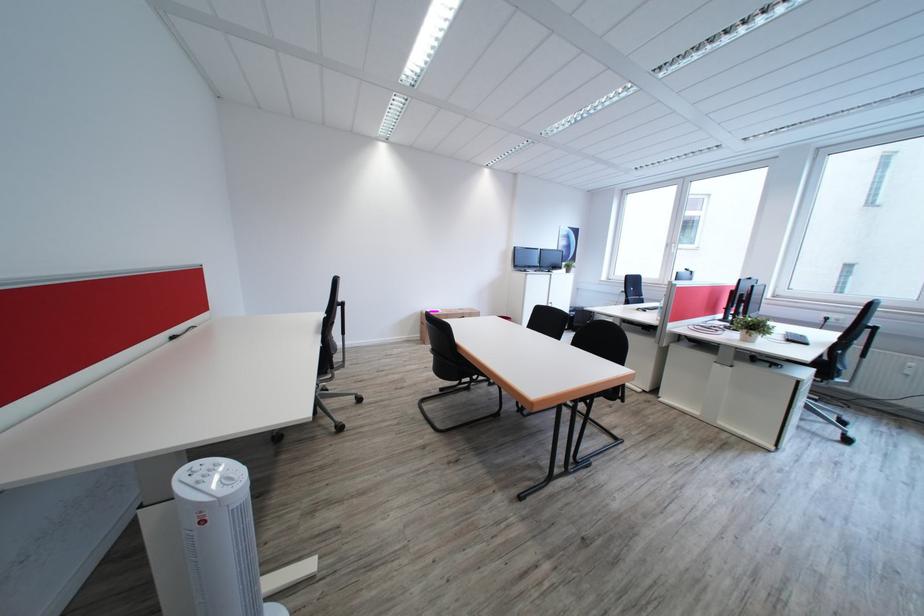
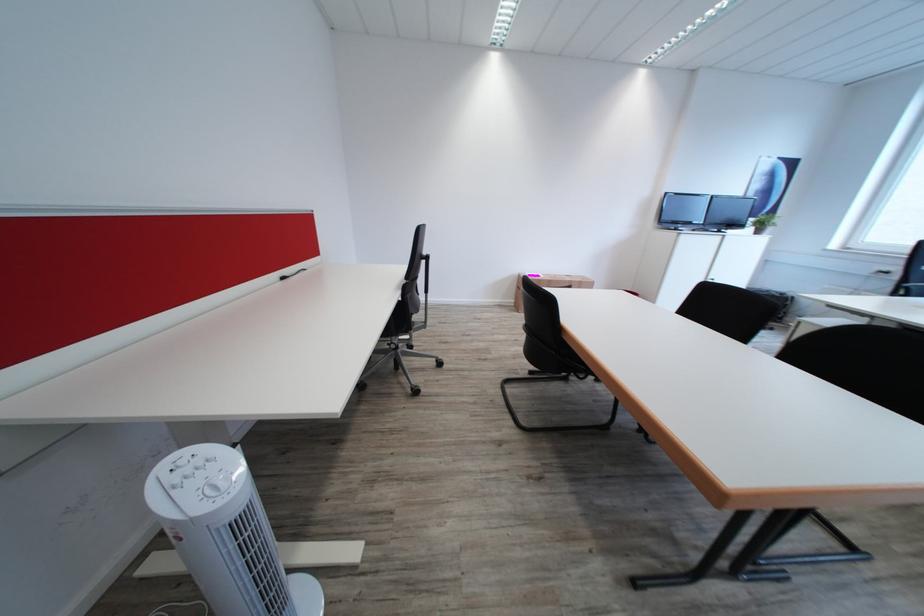
Question: What movement of the cameraman would produce the second image?

Choices:
 (A) Left
 (B) Right
 (C) Forward
 (D) Backward

Answer: (C)